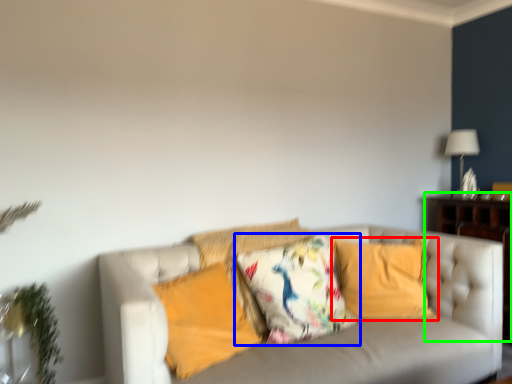
Question: Considering the real-world distances, which object is farthest from pillow (highlighted by a red box)? pillow (highlighted by a blue box) or dresser (highlighted by a green box)?

Choices:
 (A) pillow
 (B) dresser

Answer: (B)